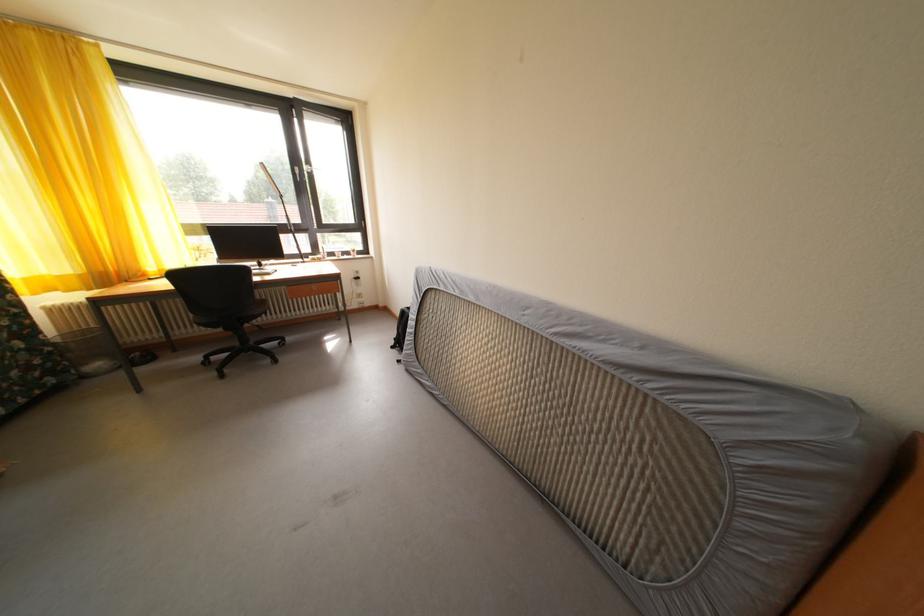
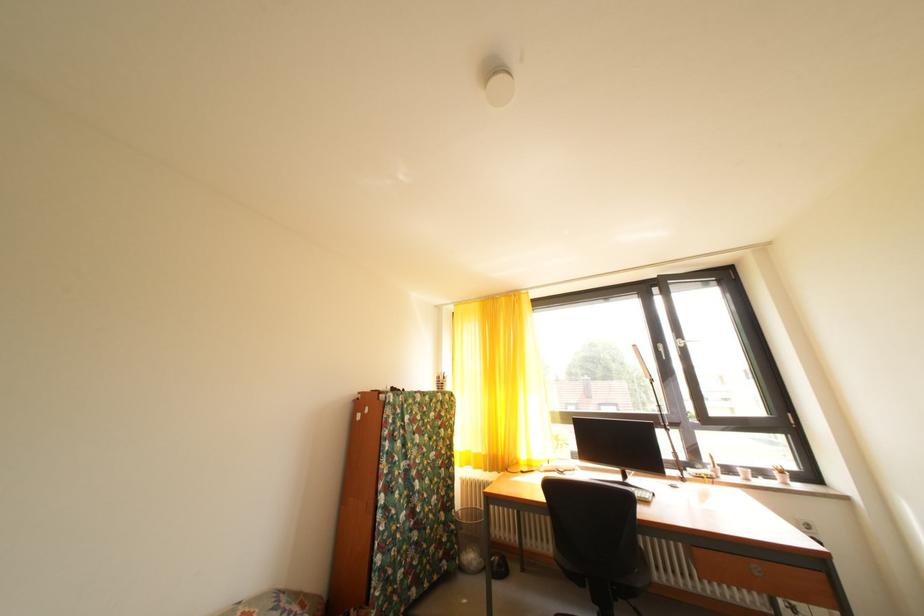
In the second image, find the point that corresponds to (58,355) in the first image.

(462, 533)